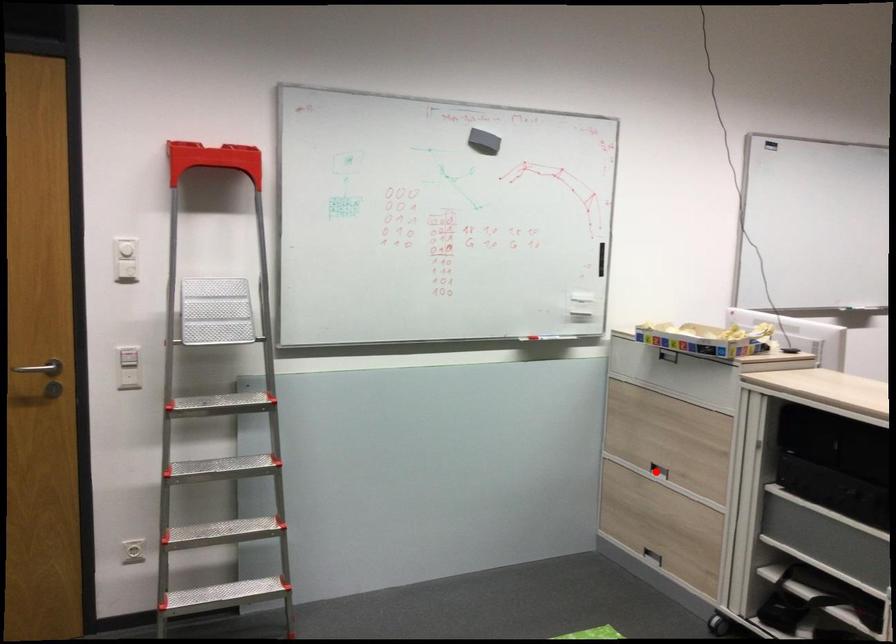
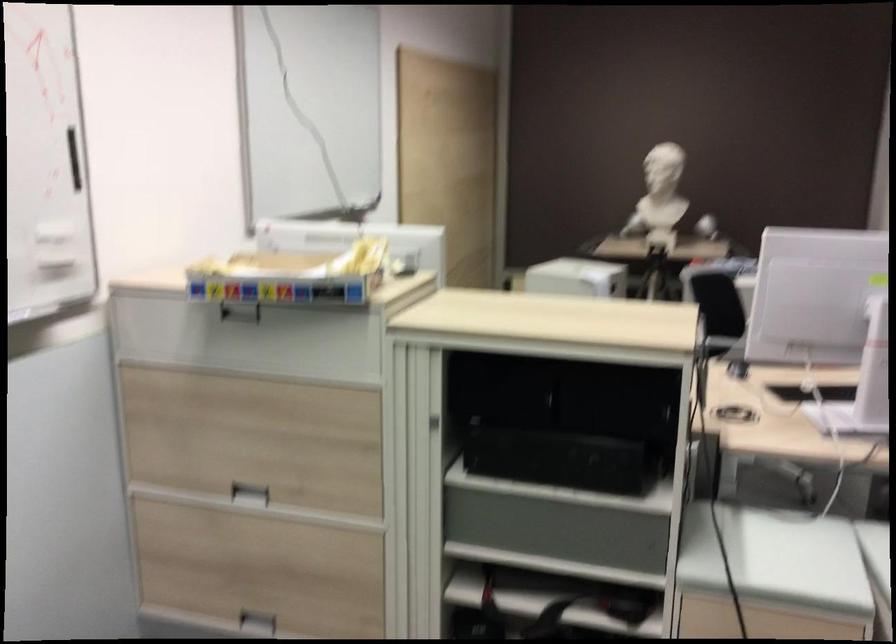
Where in the second image is the point corresponding to the highlighted location from the first image?

(250, 494)